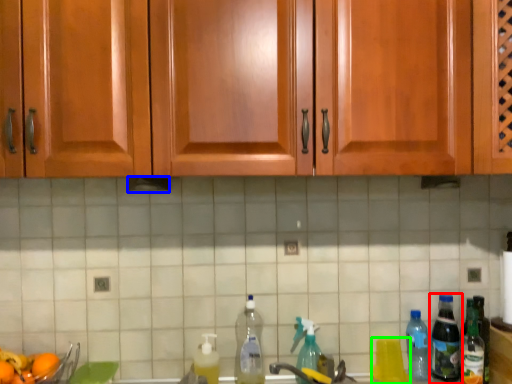
Question: Based on their relative distances, which object is farther from bottle (highlighted by a red box)? Choose from exhaust hood (highlighted by a blue box) and bottle (highlighted by a green box).

Choices:
 (A) exhaust hood
 (B) bottle

Answer: (A)